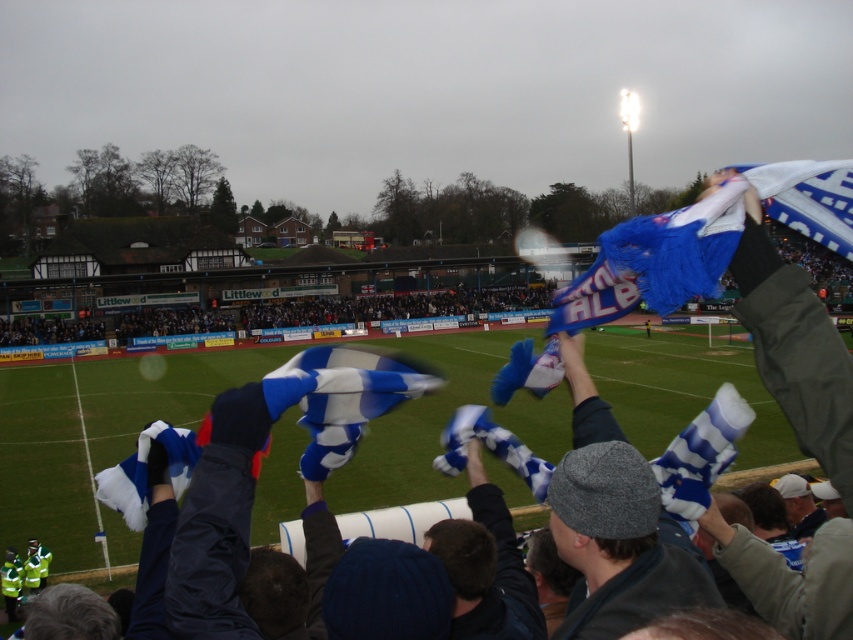
You are a drone operator trying to capture a closeup shot of the blue and white striped scarf at upper right and the blue and white fabric at upper center. The drone has a maximum range of 35 feet. Can you get both objects in the same shot without moving the drone?

The distance between the blue and white striped scarf at upper right and the blue and white fabric at upper center is 37.20 feet, which exceeds the drone operator maximum range of 35 feet. Therefore, the drone cannot capture both objects in the same shot without moving.

Looking at this image, you are a photographer standing at the edge of the stadium pitch. You want to take a photo that includes both the blue and white striped scarf at upper right and the blue and white fabric at upper center. Which object should you focus on first to ensure both are in frame?

The blue and white striped scarf at upper right is closer to you than the blue and white fabric at upper center, so you should focus on the blue and white striped scarf at upper right first to ensure both are in frame.